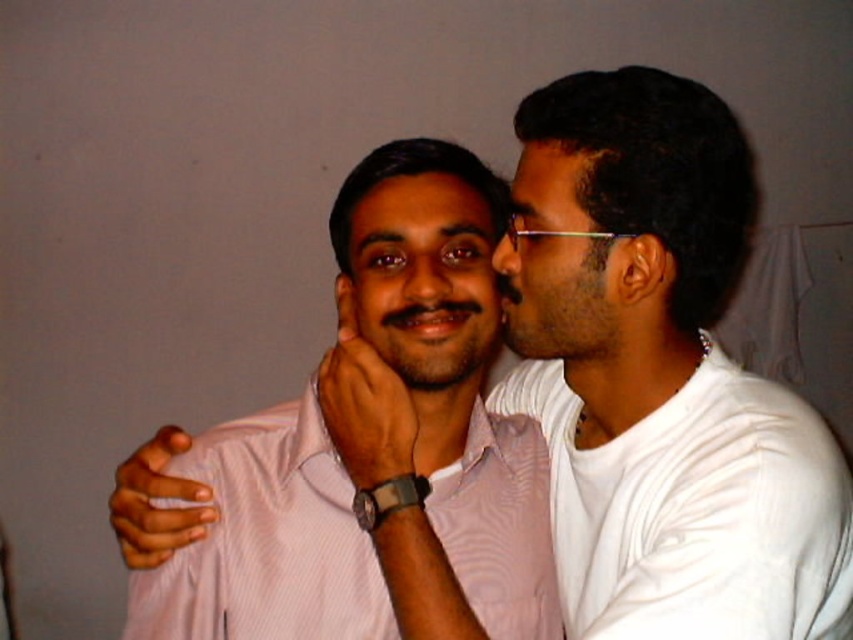
You are a photographer setting up for a portrait. You need to adjust the camera height to capture both the pink striped dress shirt at center and the matte pink shirt at center in focus. Which shirt should you position the camera closer to to ensure both are in focus?

The pink striped dress shirt at center is much taller than the matte pink shirt at center. To ensure both are in focus, position the camera closer to the taller pink striped dress shirt at center so that the depth of field can cover both subjects effectively.

You are a photographer trying to capture a portrait of the two people wearing the pink striped dress shirt at center and the matte pink shirt at center. The camera you are using has a minimum focusing distance of 7 inches. Will you be able to take a clear photo of both subjects without moving the camera or the subjects?

The pink striped dress shirt at center is 6.95 inches away from the matte pink shirt at center, which is less than the camera minimum focusing distance of 7 inches. Therefore, the camera cannot focus properly, so you will not be able to take a clear photo of both subjects without adjusting the distance.

You are an AI analyzing the positioning of clothing items in the image. The scene shows two people interacting. Please identify the coordinates of the white cotton dress shirt at right in the image coordinate system where the origin is at the bottom left corner.

The white cotton dress shirt at right is located at coordinates point (695, 512).